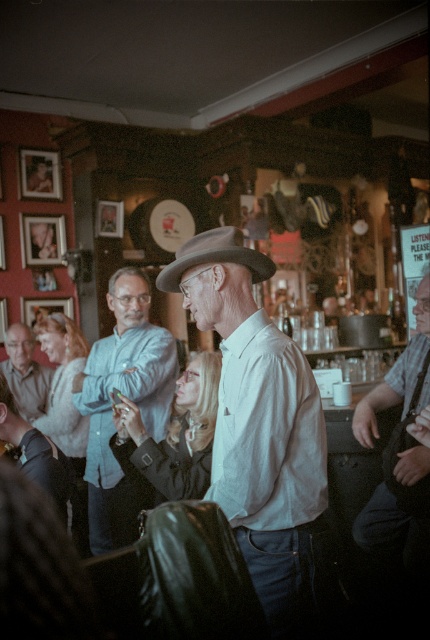
Question: Is gray felt fedora at center wider than matte gray shirt at lower left?

Choices:
 (A) yes
 (B) no

Answer: (B)

Question: Estimate the real-world distances between objects in this image. Which object is closer to the light blue shirt at center?

Choices:
 (A) gray felt fedora at center
 (B) matte gray shirt at lower left

Answer: (A)

Question: Among these objects, which one is nearest to the camera?

Choices:
 (A) matte gray shirt at lower left
 (B) gray felt fedora at center

Answer: (B)

Question: Which object appears closest to the camera in this image?

Choices:
 (A) matte gray shirt at lower left
 (B) gray felt fedora at center
 (C) light blue shirt at center

Answer: (B)

Question: Is light blue shirt at center bigger than gray felt fedora at center?

Choices:
 (A) yes
 (B) no

Answer: (A)

Question: Does gray felt fedora at center appear over matte gray shirt at lower left?

Choices:
 (A) no
 (B) yes

Answer: (B)